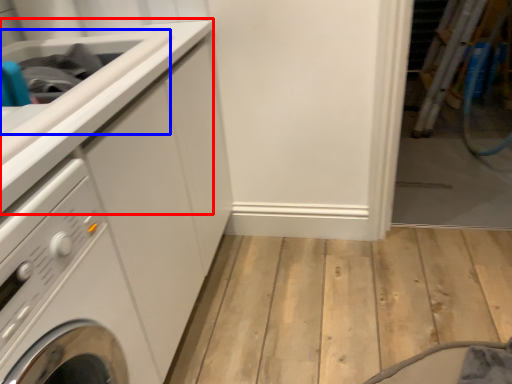
Question: Which of the following is the closest to the observer, counter top (highlighted by a red box) or sink (highlighted by a blue box)?

Choices:
 (A) counter top
 (B) sink

Answer: (A)